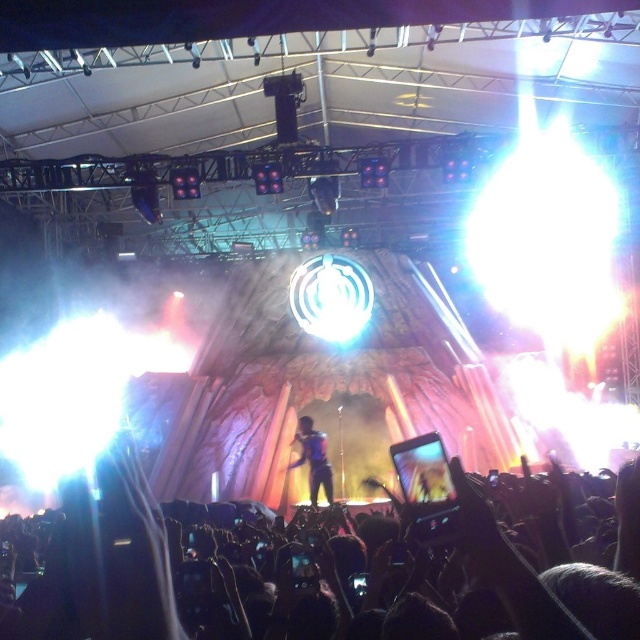
You are a photographer trying to capture the best angle of the concert. You notice two points marked in the image, point 1 at coordinates point [81,536] and point 2 at coordinates point [324,440]. If you want to focus on the point that is closer to you, which coordinate should you aim your camera at?

Point [81,536] is closer to the viewer than point [324,440], so you should aim your camera at point [81,536] to focus on the closer point.

You are a photographer trying to capture the performer in the metallic blue suit at center without including the black matte crowd at lower center in the shot. Given their sizes, is it possible to frame the photo this way?

The black matte crowd at lower center has a larger size compared to metallic blue suit at center. Therefore, it might be challenging to frame the photo without including the black matte crowd at lower center, as it occupies more space in the image.

You are a stagehand who needs to position a new spotlight. The spotlight can only be aimed at coordinates between 0.7 and 0.9 on the x and y axes. Given the black matte crowd at lower center, is the spotlight safe to activate without shining directly on the crowd?

The black matte crowd at lower center is located at coordinates point (304,564). Since the spotlight can only be aimed between 0.7 and 0.9 on both axes, the spotlight can be activated safely as the crowd is within the target area. However, since the crowd is at 0.475 on the y axis, which is below the spotlight range of 0.7 to 0.9, the spotlight will not shine directly on the crowd.